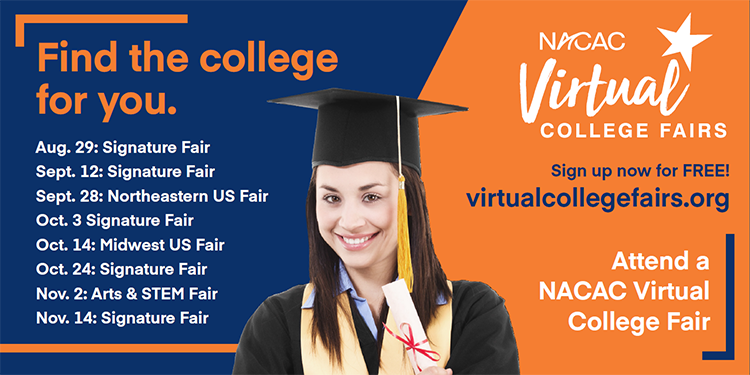
Where is `tassle`? tassle is located at coordinates (404, 255).